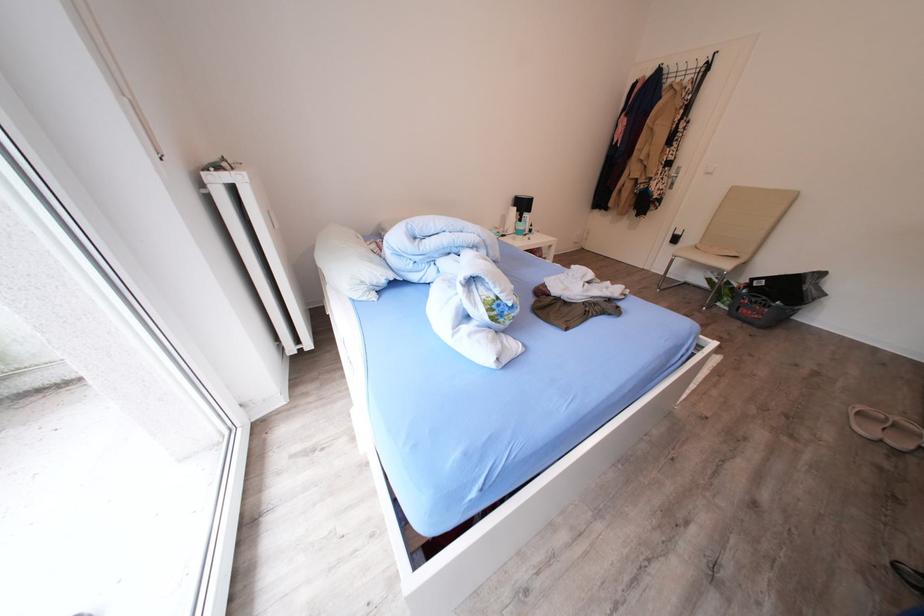
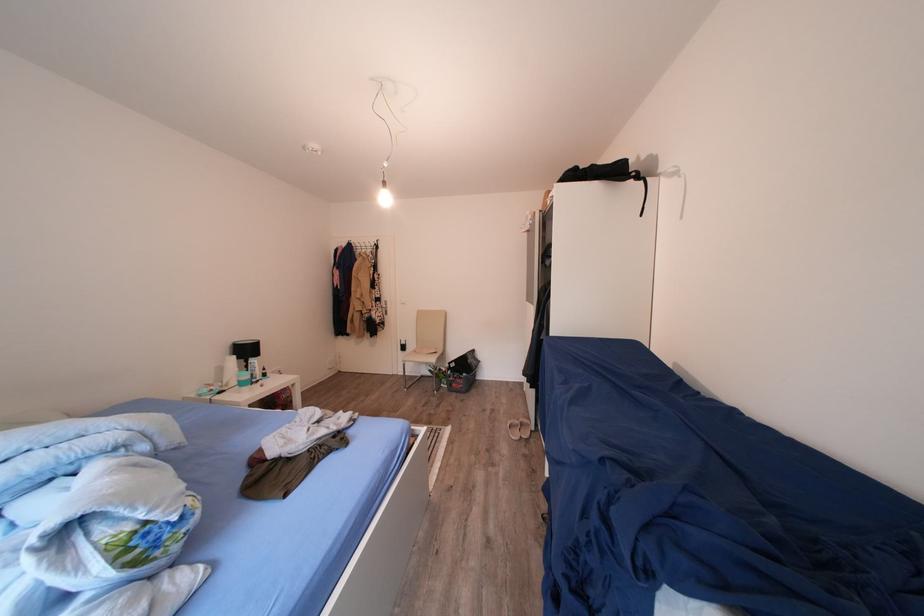
Find the pixel in the second image that matches pixel 531 209 in the first image.

(256, 355)